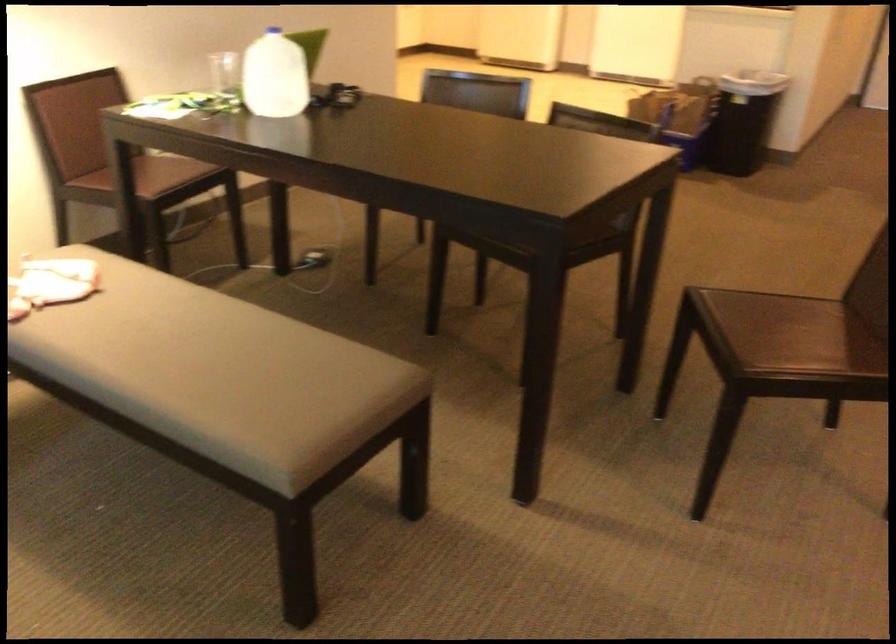
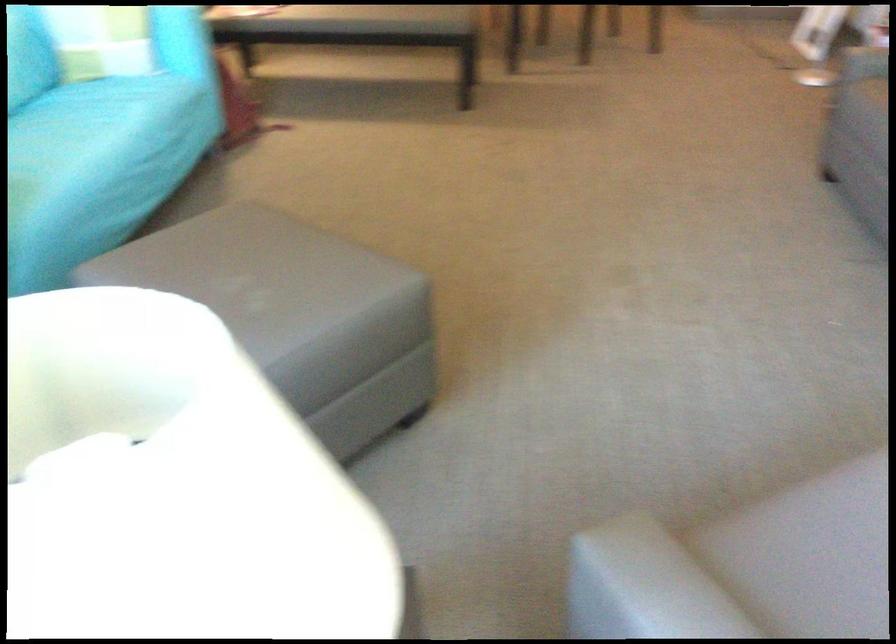
The images are taken continuously from a first-person perspective. In which direction are you moving?

The cameraman walked toward left, backward.